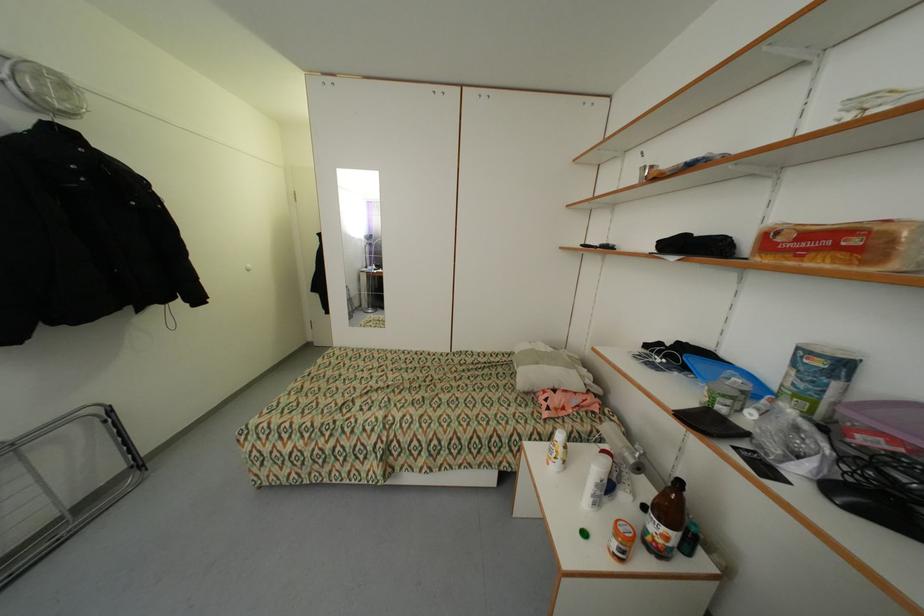
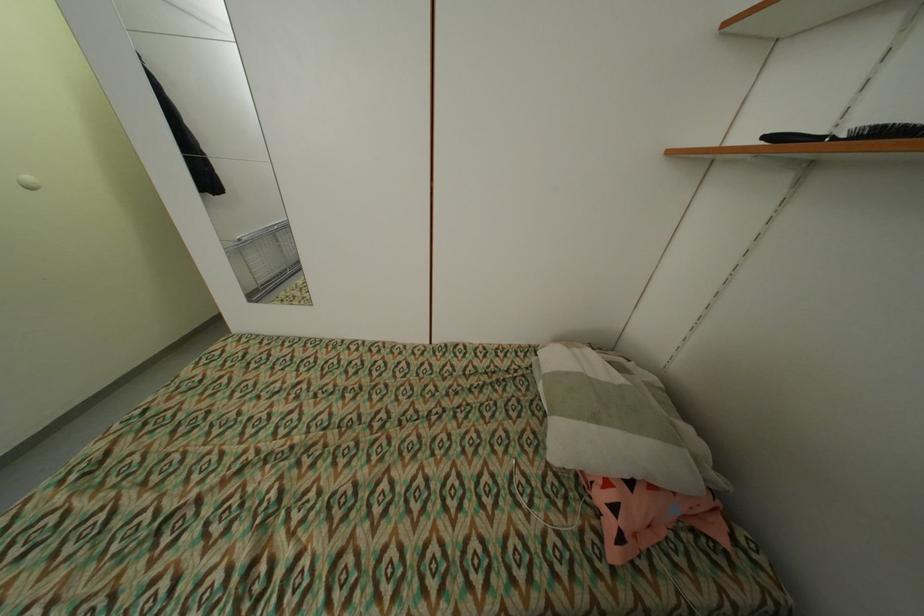
Question: What movement of the cameraman would produce the second image?

Choices:
 (A) Left
 (B) Right
 (C) Forward
 (D) Backward

Answer: (C)